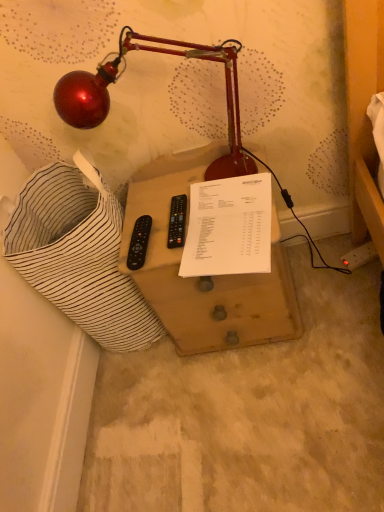
Where is `blank area beneath metallic red lamp at upper left (from a real-world perspective)`? blank area beneath metallic red lamp at upper left (from a real-world perspective) is located at coordinates (167, 195).